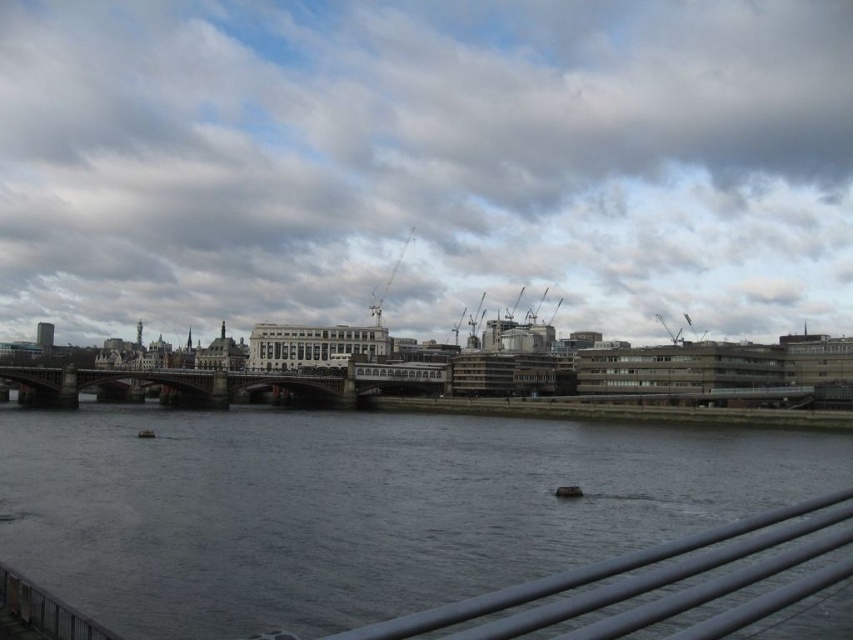
Question: Which point is closer to the camera taking this photo?

Choices:
 (A) (404, 248)
 (B) (109, 372)
 (C) (573, 301)
 (D) (154, 435)

Answer: (D)

Question: Is cloudy sky at upper center to the left of dark gray metallic boat at center from the viewer's perspective?

Choices:
 (A) yes
 (B) no

Answer: (A)

Question: Can you confirm if satin silver rail at lower center is positioned below metallic gray crane at upper center?

Choices:
 (A) yes
 (B) no

Answer: (A)

Question: Can you confirm if metallic gray crane at upper center is positioned to the left of dark gray metallic boat at center?

Choices:
 (A) no
 (B) yes

Answer: (B)

Question: Which of the following is the closest to the observer?

Choices:
 (A) dark gray metallic boat at center
 (B) metallic gray bridge at center
 (C) dark gray water at center

Answer: (C)

Question: Among these points, which one is nearest to the camera?

Choices:
 (A) (613, 472)
 (B) (138, 433)
 (C) (579, 493)
 (D) (664, 234)

Answer: (C)